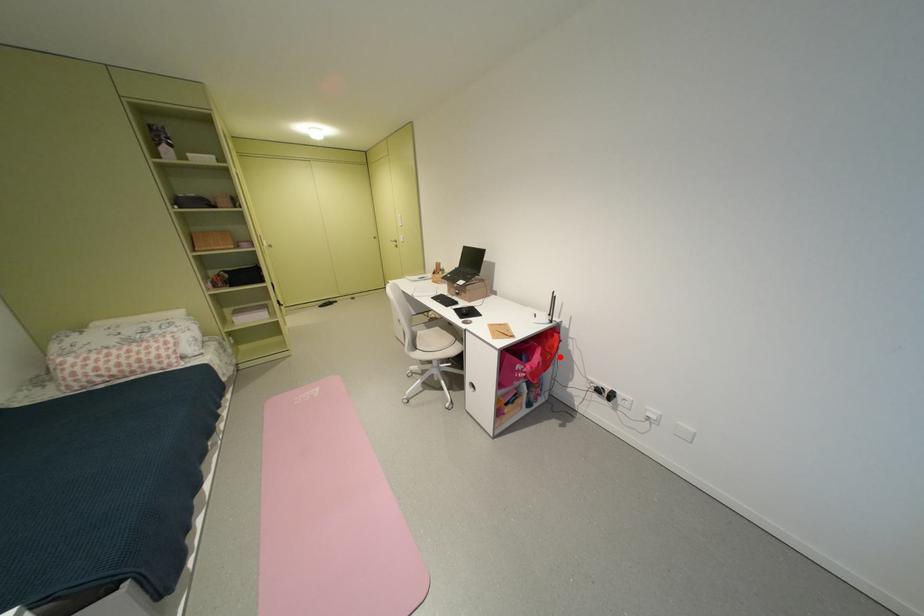
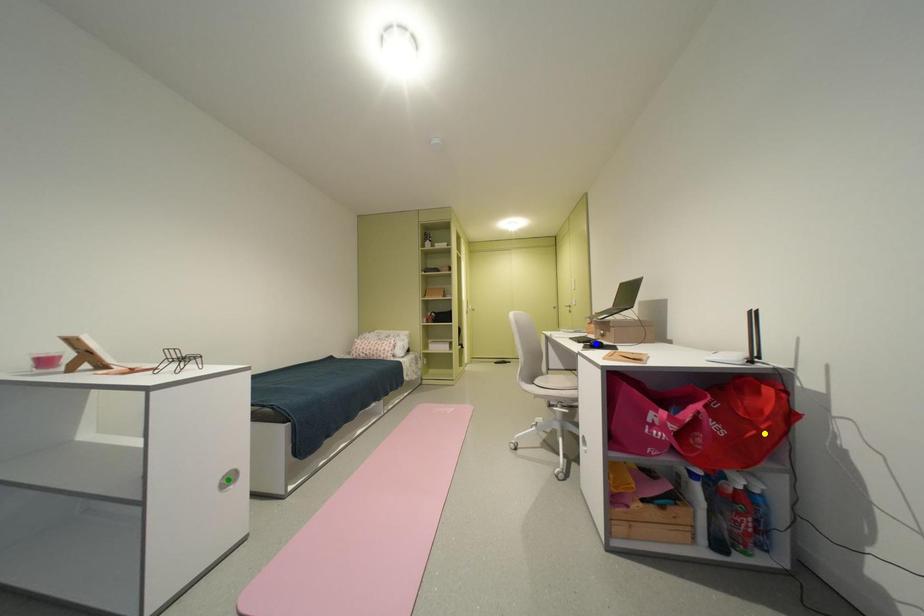
Question: I am providing you with two images of the same scene from different viewpoints. A red point is marked on the first image. You are given multiple points on the second image. Can you choose the point in image 2 that corresponds to the point in image 1?

Choices:
 (A) blue point
 (B) yellow point
 (C) green point

Answer: (B)